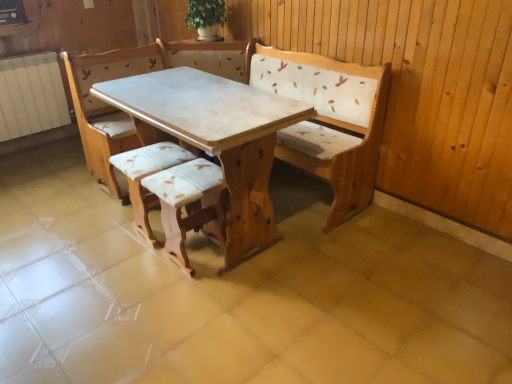
Question: From a real-world perspective, is white painted metal radiator at left physically located above or below white marble table at center?

Choices:
 (A) above
 (B) below

Answer: (A)

Question: Considering the positions of white painted metal radiator at left and white marble table at center in the image, is white painted metal radiator at left wider or thinner than white marble table at center?

Choices:
 (A) thin
 (B) wide

Answer: (A)

Question: Which is nearer to the wooden armchair at center, which is the 2th armchair in left-to-right order?

Choices:
 (A) matte white cushioned stool at center, which is the second armchair in right-to-left order
 (B) white painted metal radiator at left
 (C) white marble table at center

Answer: (A)

Question: Considering the real-world distances, which object is farthest from the white marble table at center?

Choices:
 (A) matte white cushioned stool at center, which is the first armchair in left-to-right order
 (B) wooden armchair at center, the 1th armchair viewed from the right
 (C) white painted metal radiator at left

Answer: (C)